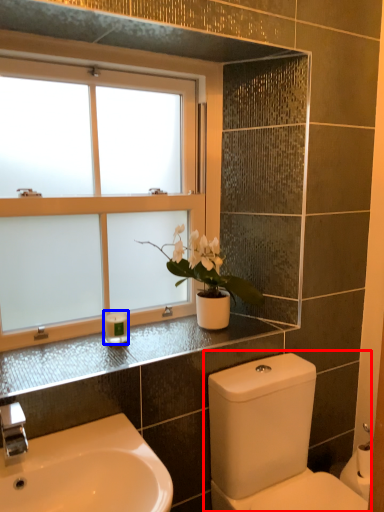
Question: Which object appears closest to the camera in this image, toilet (highlighted by a red box) or toiletry (highlighted by a blue box)?

Choices:
 (A) toilet
 (B) toiletry

Answer: (A)